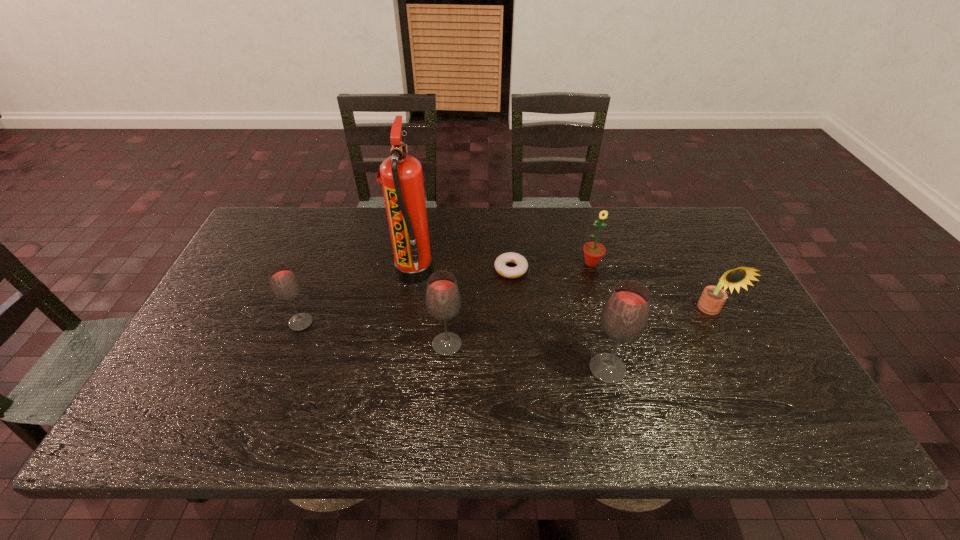
This screenshot has height=540, width=960. I want to click on free space between the rightmost object and the rightmost glass drink container, so click(659, 340).

This screenshot has width=960, height=540. What are the coordinates of `free area in between the second tallest glass drink container and the doughnut` in the screenshot? It's located at (479, 307).

You are a GUI agent. You are given a task and a screenshot of the screen. Output one action in this format:
    pyautogui.click(x=<x>, y=<y>)
    Task: Click on the free area in between the nearer sunflower and the doughnut
    This screenshot has width=960, height=540.
    Given the screenshot: What is the action you would take?
    [611, 290]

Locate an element on the screen. The height and width of the screenshot is (540, 960). unoccupied area between the nearer sunflower and the tallest object is located at coordinates (563, 291).

Identify the location of empty space between the rightmost glass drink container and the doughnut. This screenshot has height=540, width=960. (559, 319).

What are the coordinates of `vacant space that is in between the farther sunflower and the second tallest glass drink container` in the screenshot? It's located at 519,303.

Choose which object is the nearest neighbor to the leftmost glass drink container. Please provide its 2D coordinates. Your answer should be formatted as a tuple, i.e. [(x, y)], where the tuple contains the x and y coordinates of a point satisfying the conditions above.

[(401, 175)]

Select which object appears as the fifth closest to the shortest object. Please provide its 2D coordinates. Your answer should be formatted as a tuple, i.e. [(x, y)], where the tuple contains the x and y coordinates of a point satisfying the conditions above.

[(712, 299)]

Identify the location of glass drink container that is the third closest to the tallest object. The image size is (960, 540). (625, 315).

Locate which glass drink container is the second closest to the leftmost object. Please provide its 2D coordinates. Your answer should be formatted as a tuple, i.e. [(x, y)], where the tuple contains the x and y coordinates of a point satisfying the conditions above.

[(625, 315)]